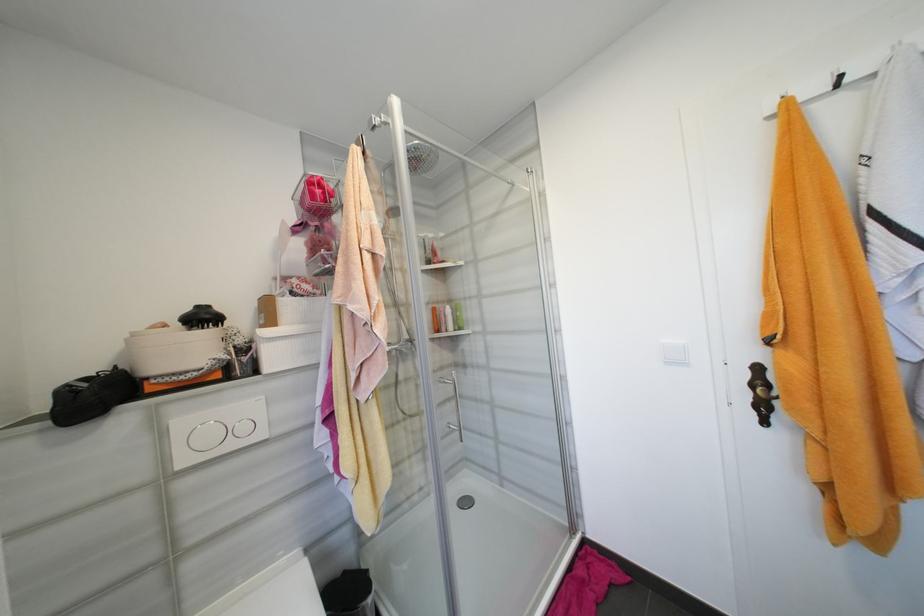
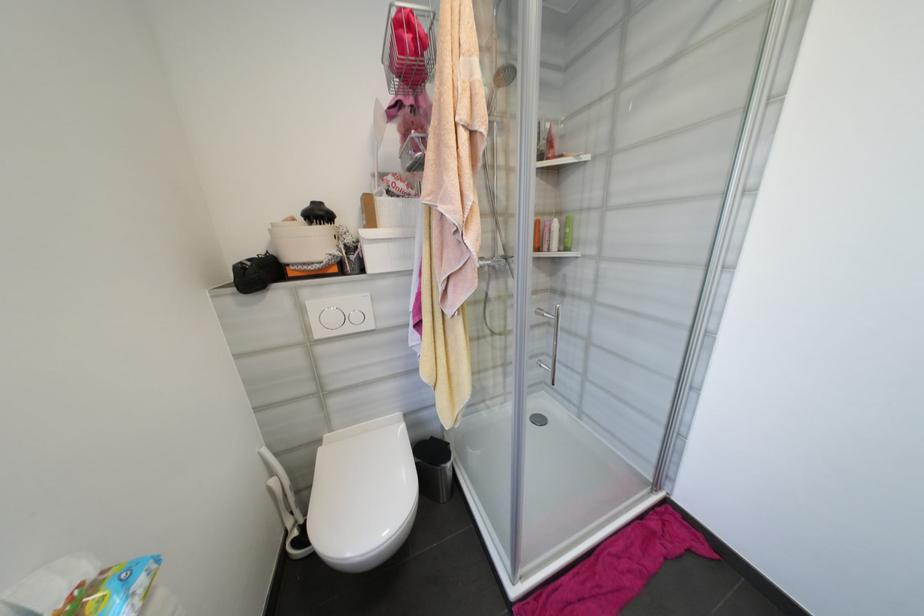
Locate, in the second image, the point that corresponds to (x=249, y=429) in the first image.

(361, 318)